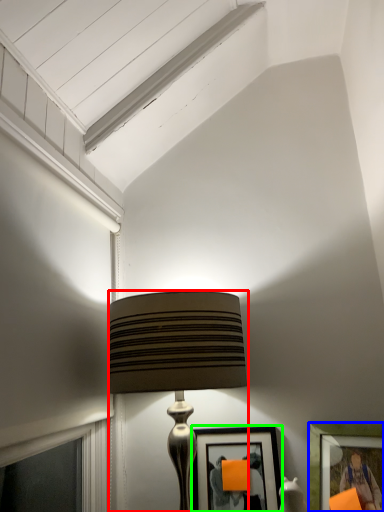
Question: Which object is positioned farthest from lamp (highlighted by a red box)? Select from picture frame (highlighted by a blue box) and picture frame (highlighted by a green box).

Choices:
 (A) picture frame
 (B) picture frame

Answer: (A)